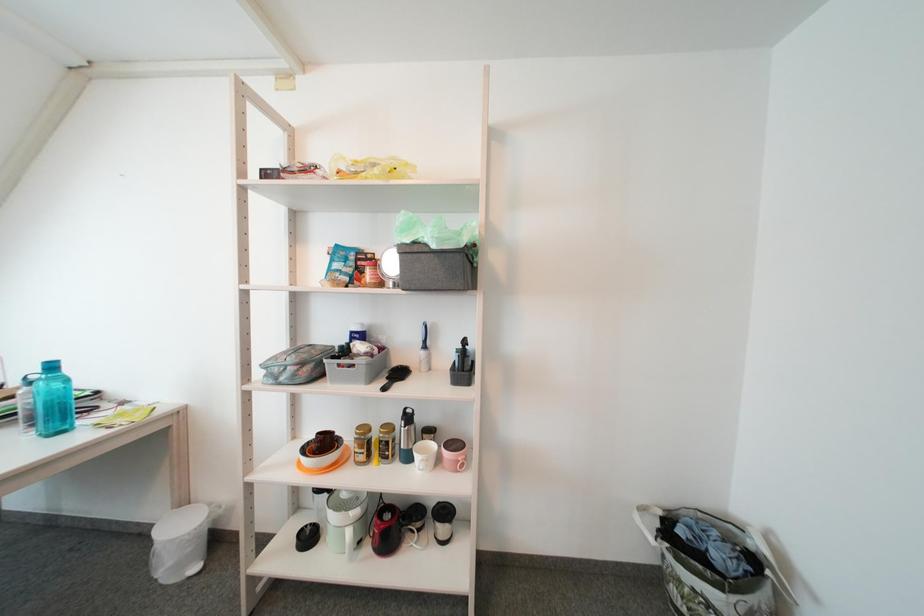
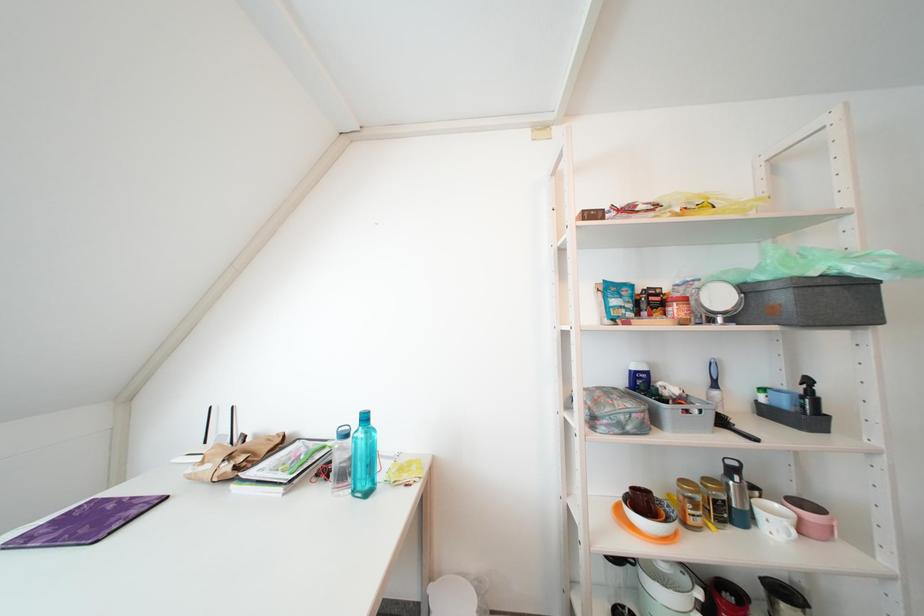
Question: Which direction would the cameraman need to move to produce the second image? Reply with the corresponding letter.

Choices:
 (A) Left
 (B) Right
 (C) Forward
 (D) Backward

Answer: (A)